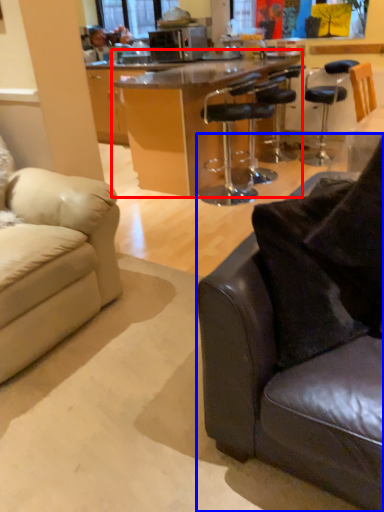
Question: Which object is further to the camera taking this photo, table (highlighted by a red box) or studio couch (highlighted by a blue box)?

Choices:
 (A) table
 (B) studio couch

Answer: (A)